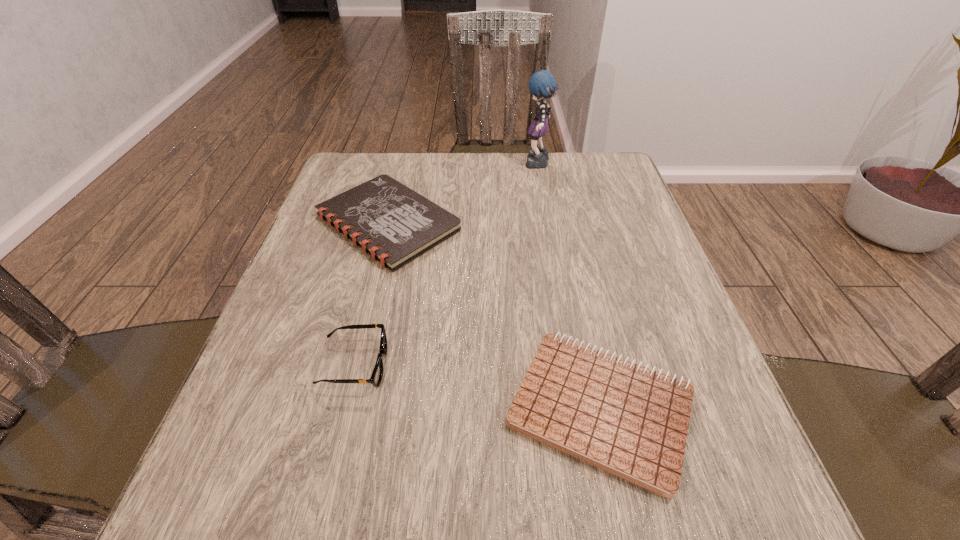
This screenshot has width=960, height=540. I want to click on rag doll, so click(x=542, y=84).

Locate an element on the screen. The height and width of the screenshot is (540, 960). the farthest object is located at coordinates (542, 84).

Where is `the third shortest object`? The image size is (960, 540). the third shortest object is located at coordinates (377, 374).

I want to click on the third nearest object, so click(x=394, y=224).

Image resolution: width=960 pixels, height=540 pixels. Identify the location of the farther notebook. (394, 224).

Where is `the shortest object`? The width and height of the screenshot is (960, 540). the shortest object is located at coordinates (631, 421).

Identify the location of the shorter notebook. The height and width of the screenshot is (540, 960). (631, 421).

The height and width of the screenshot is (540, 960). Identify the location of vacant area located 0.170m on the front-facing side of the tallest object. (463, 165).

Locate an element on the screen. vacant space located on the front-facing side of the tallest object is located at coordinates (427, 165).

Identify the location of vacant position located on the front-facing side of the tallest object. Image resolution: width=960 pixels, height=540 pixels. point(498,165).